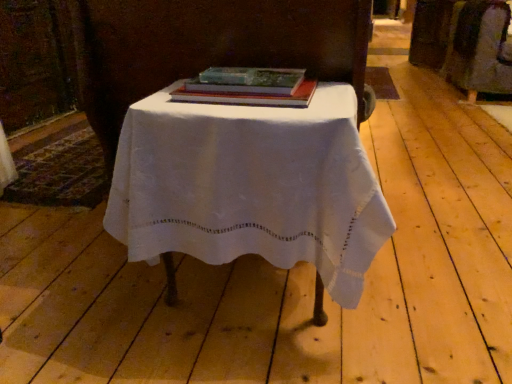
I want to click on free space to the left of white cloth-covered table at center, so click(x=74, y=291).